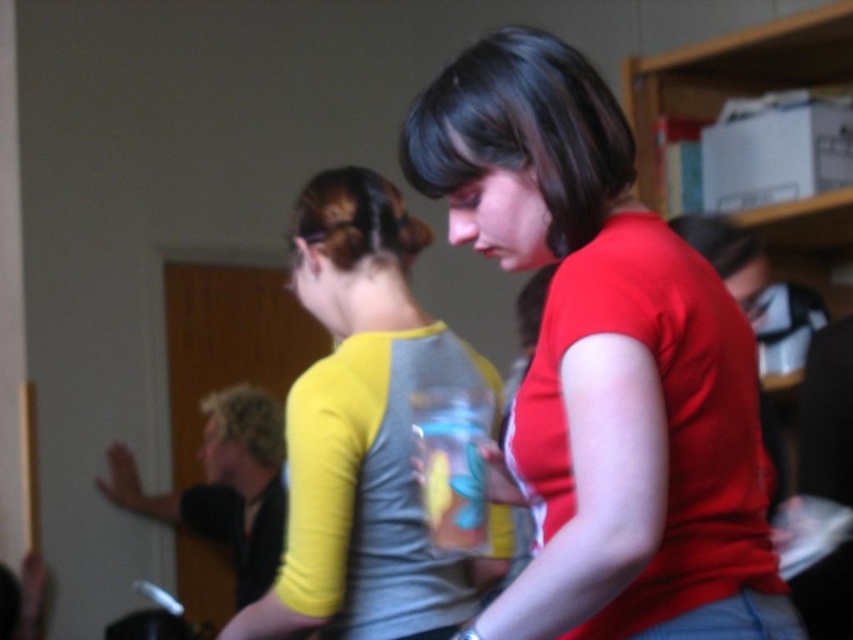
You are standing in the classroom and need to determine which of the two points, point (664, 529) or point (396, 563), is closer to you. Based on the scene description, which point is nearer?

Point (664, 529) is closer to the viewer than point (396, 563).

Two women are sitting at a table in a classroom. One is wearing a red matte shirt at center and the other is wearing a yellow and gray long sleeved shirt. How far apart are their faces?

The red matte shirt at center is 32.98 inches away from the other woman.